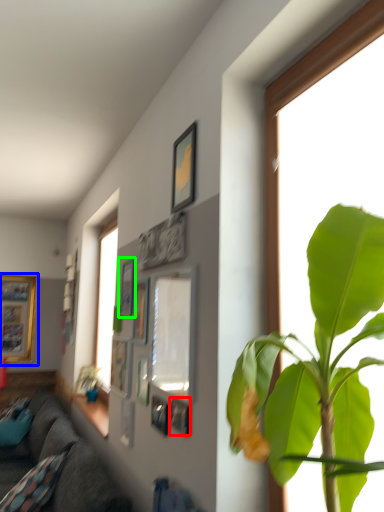
Question: Which object is the closest to the picture frame (highlighted by a red box)? Choose among these: picture frame (highlighted by a blue box) or picture frame (highlighted by a green box).

Choices:
 (A) picture frame
 (B) picture frame

Answer: (B)